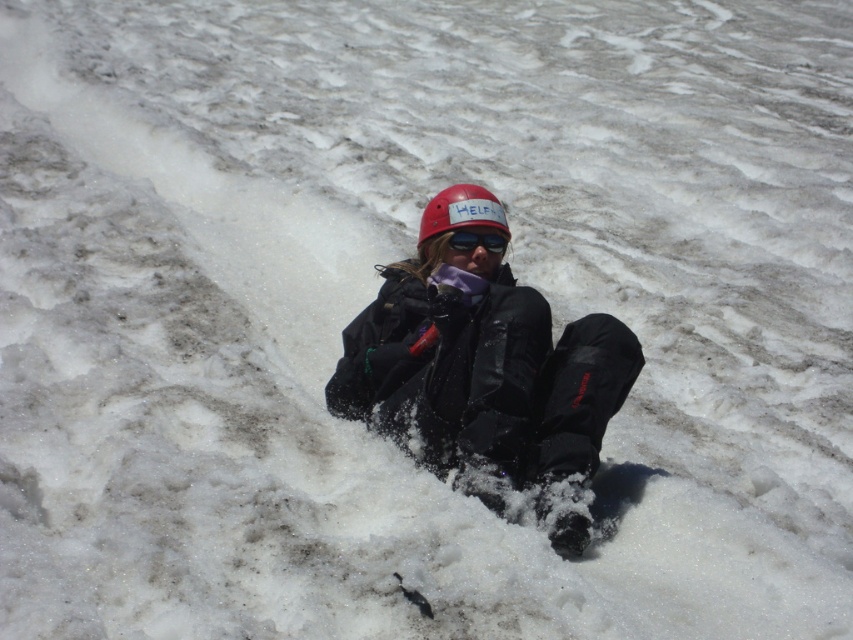
You are a rescue worker trying to locate the person in the snowy slope. You have two coordinates marked on your map, point (445, 211) and point (473, 241). Which point is closer to the person?

Point (445, 211) is further to the viewer than point (473, 241), so the person is closer to point (473, 241).

Looking at this image, you are a rescue worker trying to locate the person in the snow. You have a drone with a camera that can capture objects within a 2 inch radius. The drone is currently hovering above the person. Can the drone capture both the matte red helmet at center and the black reflective sunglasses at center in the same photo?

The matte red helmet at center is 2.12 inches away from black reflective sunglasses at center. Since the drone can capture objects within a 2 inch radius, the distance between them exceeds the camera range. Therefore, the drone cannot capture both in the same photo.